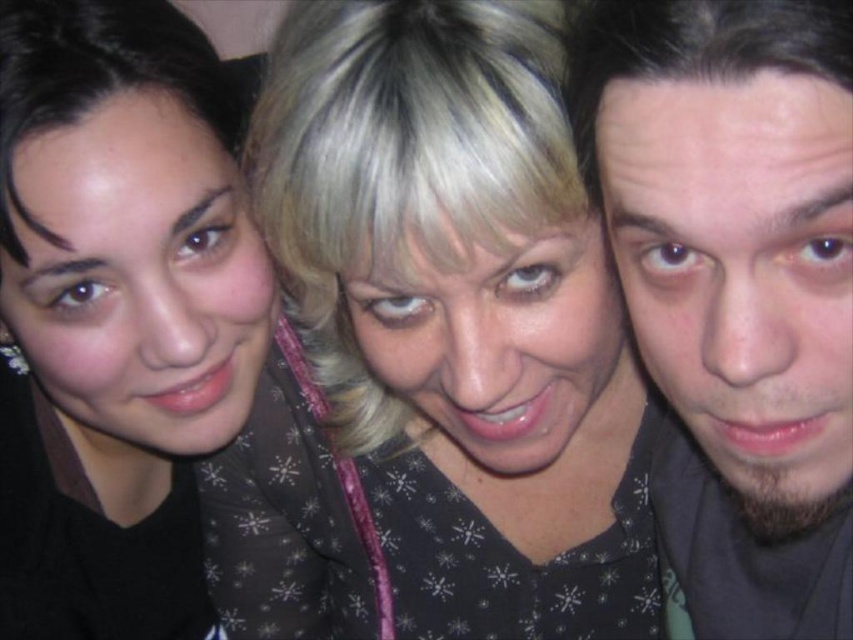
You are a photographer trying to adjust the lighting for a group photo. You notice two people in the frame with matte black faces. Where is the matte black face at left in relation to the matte black face at center?

The matte black face at left is positioned to the left of the matte black face at center.

Based on the scene description, which person has a shorter height between the beige matte skin at right and the matte black face at left?

The beige matte skin at right is shorter than the matte black face at left.

Based on the scene description, where is the beige matte skin at right located in the image?

The beige matte skin at right is located at point 0.428 on the x axis and 0.870 on the y axis.